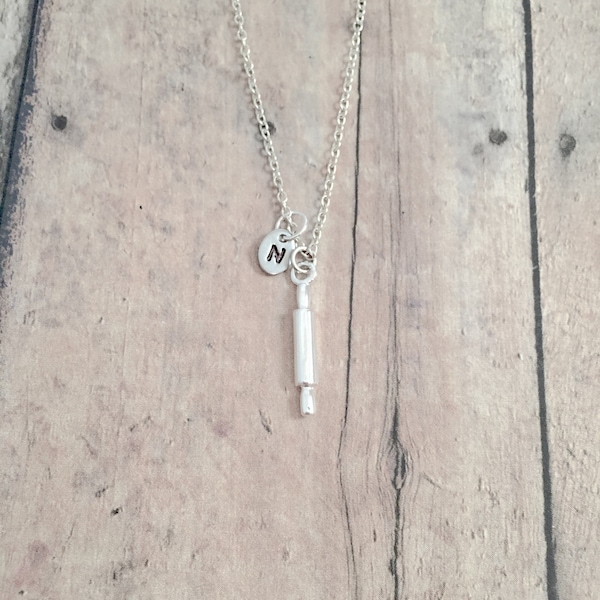
This screenshot has width=600, height=600. I want to click on long pendant, so click(479, 307), click(302, 343).